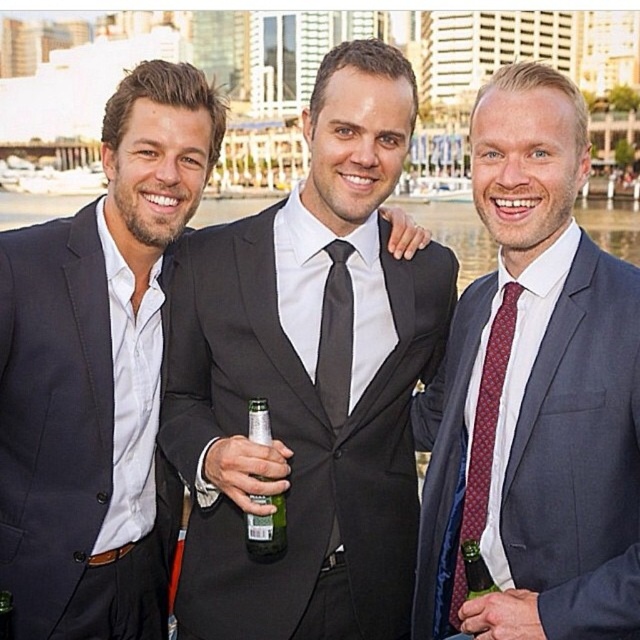
Question: Is red dotted tie at center to the right of black satin tie at center from the viewer's perspective?

Choices:
 (A) no
 (B) yes

Answer: (B)

Question: Does matte gray suit at center have a larger size compared to matte black suit at center?

Choices:
 (A) yes
 (B) no

Answer: (B)

Question: Among these objects, which one is nearest to the camera?

Choices:
 (A) matte gray suit at center
 (B) matte black suit at center
 (C) black satin suit at center
 (D) red dotted tie at center

Answer: (A)

Question: Which point is closer to the camera?

Choices:
 (A) matte gray suit at center
 (B) green glass bottle at center

Answer: (A)

Question: Is black satin suit at center bigger than green glass bottle at center?

Choices:
 (A) no
 (B) yes

Answer: (B)

Question: Which point appears farthest from the camera in this image?

Choices:
 (A) (461, 528)
 (B) (508, 358)
 (C) (330, 337)
 (D) (42, 451)

Answer: (C)